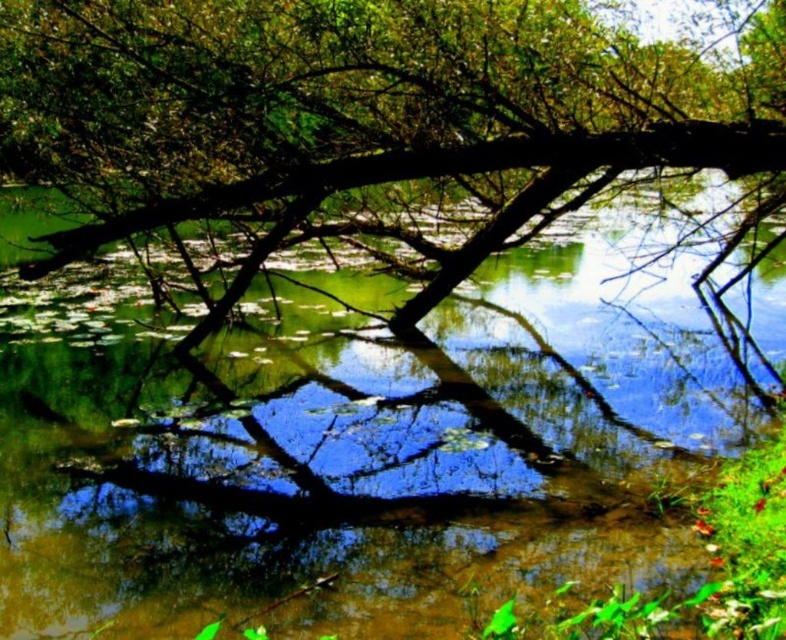
You are standing at the edge of the pond and see the green reflective water at center and the brown rough tree trunk at center. Which object is positioned to the right side of the other?

The green reflective water at center is to the right of the brown rough tree trunk at center.

You are an environmental scientist assessing the ecological health of this area. You need to determine if the green reflective water at center can accommodate a floating sensor device that requires a minimum width of 2 meters to operate safely. Given the brown rough tree trunk at center is 3 meters wide, what is your recommendation?

The green reflective water at center has a width less than the brown rough tree trunk at center, which is 3 meters wide. Since the water is narrower than 2 meters, the floating sensor device cannot operate safely here. Recommend choosing a wider water area.